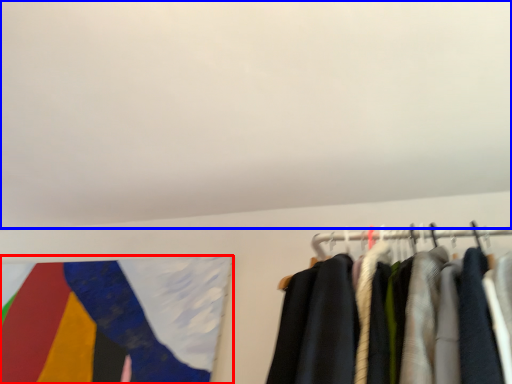
Question: Which object is further to the camera taking this photo, flag (highlighted by a red box) or backdrop (highlighted by a blue box)?

Choices:
 (A) flag
 (B) backdrop

Answer: (A)